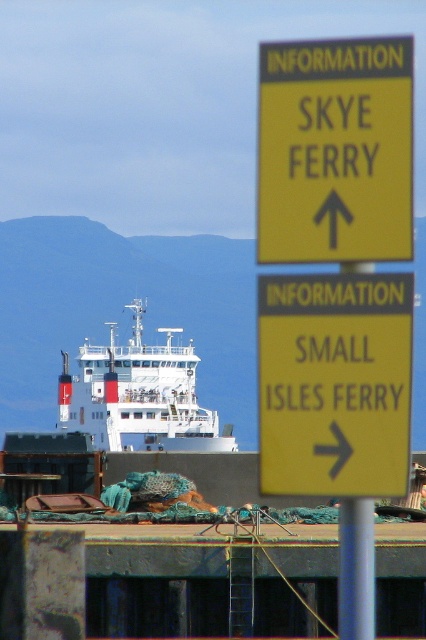
Does yellow paper sign at center appear on the right side of white matte ship at center?

Indeed, yellow paper sign at center is positioned on the right side of white matte ship at center.

Who is higher up, yellow paper sign at center or white matte ship at center?

yellow paper sign at center is higher up.

Find the location of `yellow paper sign at center`. yellow paper sign at center is located at coordinates (334, 384).

Which is in front, point (396, 173) or point (377, 442)?

Point (396, 173) is in front.

Between point (331, 202) and point (290, 308), which one is positioned behind?

The point (290, 308) is behind.

I want to click on yellow paper sign at upper center, so click(334, 150).

Is yellow paper sign at upper center closer to camera compared to white matte ship at center?

Yes, it is.

Can you confirm if yellow paper sign at upper center is positioned above white matte ship at center?

Yes, yellow paper sign at upper center is above white matte ship at center.

The width and height of the screenshot is (426, 640). What do you see at coordinates (334, 150) in the screenshot? I see `yellow paper sign at upper center` at bounding box center [334, 150].

At what (x,y) coordinates should I click in order to perform the action: click on yellow paper sign at upper center. Please return your answer as a coordinate pair (x, y). Looking at the image, I should click on (334, 150).